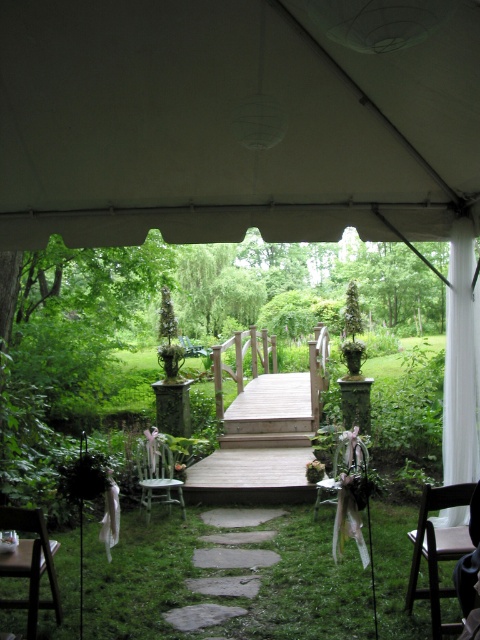
You are a guest at a garden party and need to sit down. You see two chairs, the brown wooden chair at lower right and the brown wooden chair at lower left. Which chair is taller?

The brown wooden chair at lower right is taller than the brown wooden chair at lower left.

You are standing at the entrance of the tent and want to reach the wooden bridge. You see a light green painted wood chair at center and a wooden chair at center. Which chair is closer to you?

The light green painted wood chair at center is closer to you because the wooden chair at center is behind it.